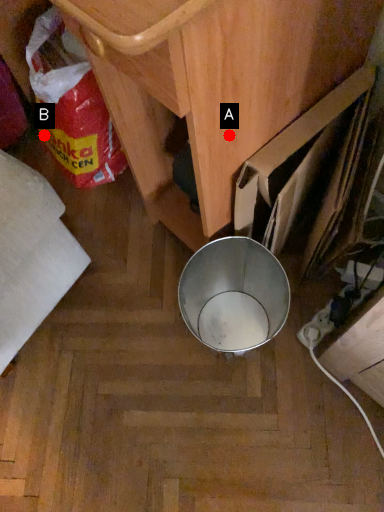
Question: Two points are circled on the image, labeled by A and B beside each circle. Which point appears farthest from the camera in this image?

Choices:
 (A) A is further
 (B) B is further

Answer: (B)